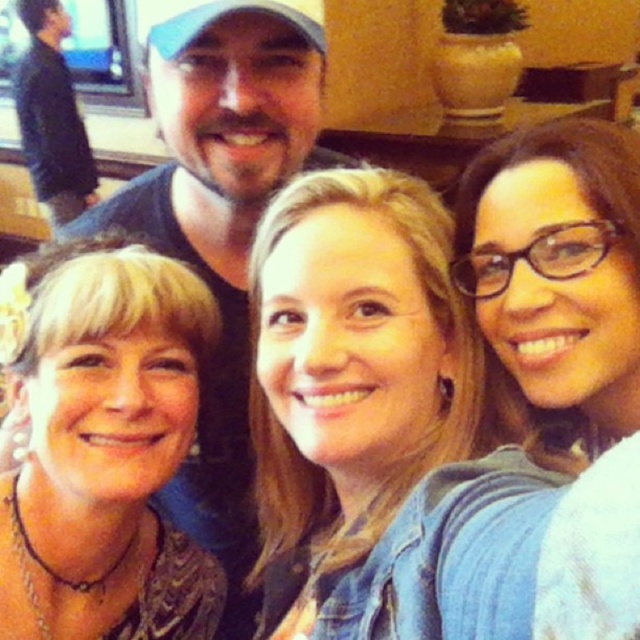
You are taking a selfie with your friends in a cozy room. You notice two black clothing items in the frame. Which one is lower between the matte black shirt at left and the black sweater at upper left?

The matte black shirt at left is positioned under the black sweater at upper left, so it is lower in the frame.

You are a photographer trying to capture a clear shot of the matte black shirt at left and the black sweater at upper left. Which one appears smaller in the photo?

The matte black shirt at left appears smaller in the photo compared to the black sweater at upper left because it has a smaller size.

You are a photographer trying to capture a group photo of the matte black shirt at left and the black sweater at upper left. Given that your camera has a maximum focus range of 2.5 meters, will you be able to capture both subjects clearly in the same frame?

The distance between the matte black shirt at left and the black sweater at upper left is 3.02 meters, which exceeds the camera maximum focus range of 2.5 meters. Therefore, you cannot capture both subjects clearly in the same frame.